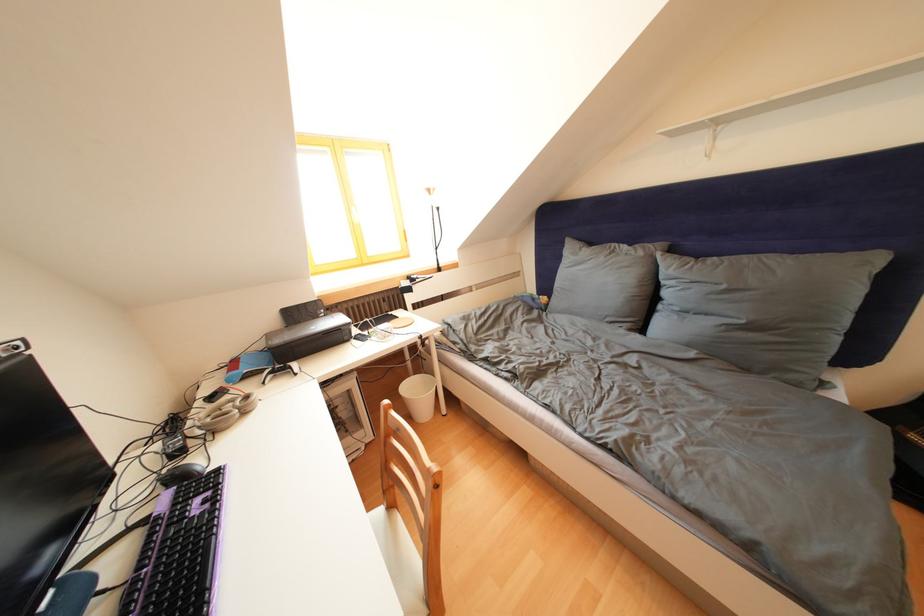
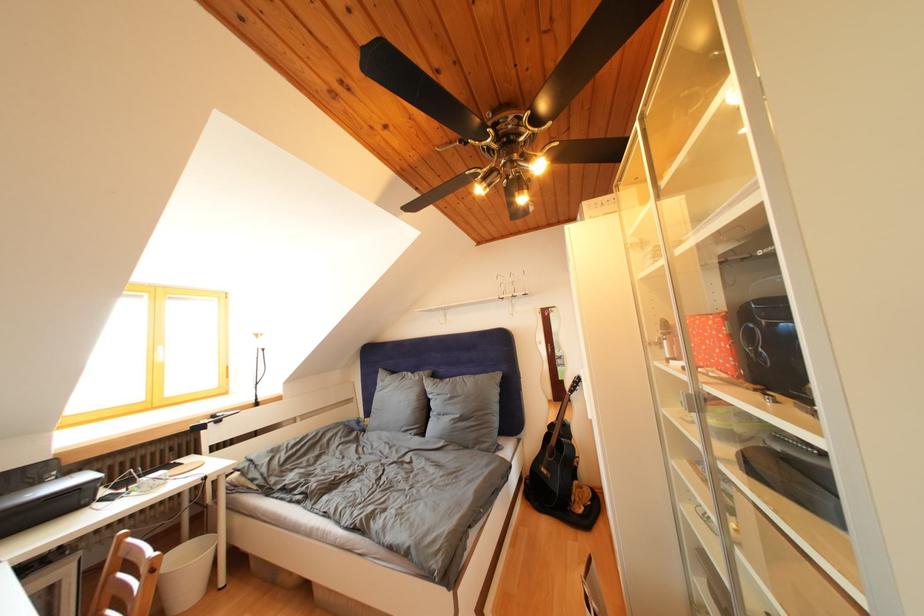
Find the pixel in the second image that matches point 649,259 in the first image.

(426, 383)